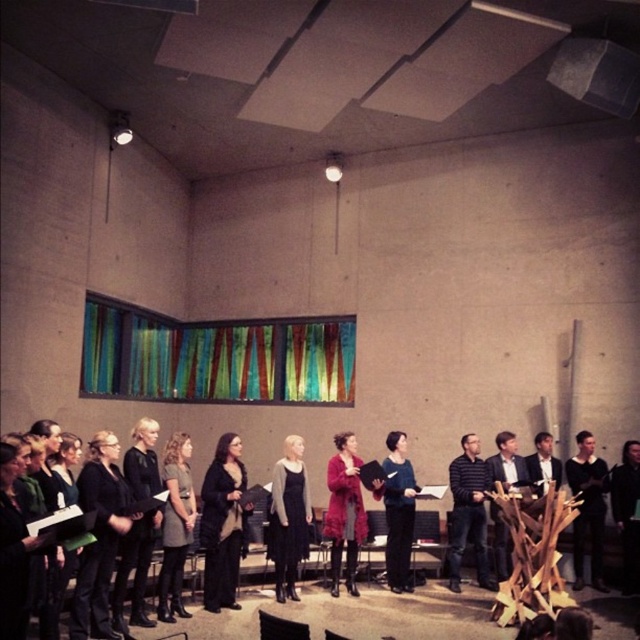
Between matte pink coat at center and striped sweater at center, which one is positioned lower?

striped sweater at center is below.

The width and height of the screenshot is (640, 640). Identify the location of matte pink coat at center. (344, 512).

The image size is (640, 640). I want to click on matte pink coat at center, so click(x=344, y=512).

Does matte pink coat at center have a lesser height compared to black leather jacket at right?

Incorrect, matte pink coat at center's height does not fall short of black leather jacket at right's.

Which is in front, point (348, 548) or point (586, 440)?

Point (348, 548)

Locate an element on the screen. Image resolution: width=640 pixels, height=640 pixels. matte pink coat at center is located at coordinates (344, 512).

Does black wool sweater at center have a lesser height compared to dark gray dress at center?

No.

Does point (221, 540) come in front of point (168, 474)?

No.

Find the location of a particular element. The image size is (640, 640). black wool sweater at center is located at coordinates (221, 522).

You are a GUI agent. You are given a task and a screenshot of the screen. Output one action in this format:
    pyautogui.click(x=<x>, y=<y>)
    Task: Click on the black wool sweater at center
    The height and width of the screenshot is (640, 640).
    Given the screenshot: What is the action you would take?
    pyautogui.click(x=221, y=522)